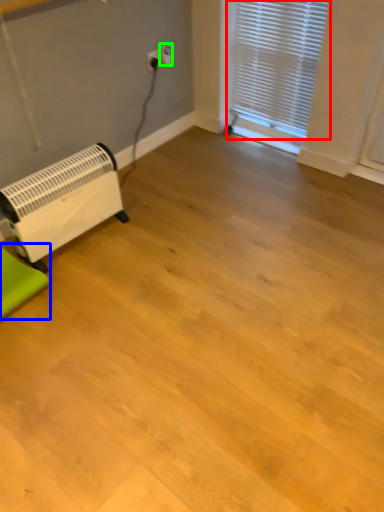
Question: Which is farther away from window blind (highlighted by a red box)? furniture (highlighted by a blue box) or electric outlet (highlighted by a green box)?

Choices:
 (A) furniture
 (B) electric outlet

Answer: (A)